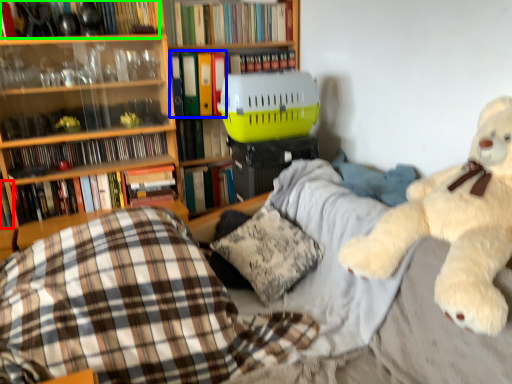
Question: Estimate the real-world distances between objects in this image. Which object is farther from book (highlighted by a red box), book (highlighted by a blue box) or book (highlighted by a green box)?

Choices:
 (A) book
 (B) book

Answer: (A)